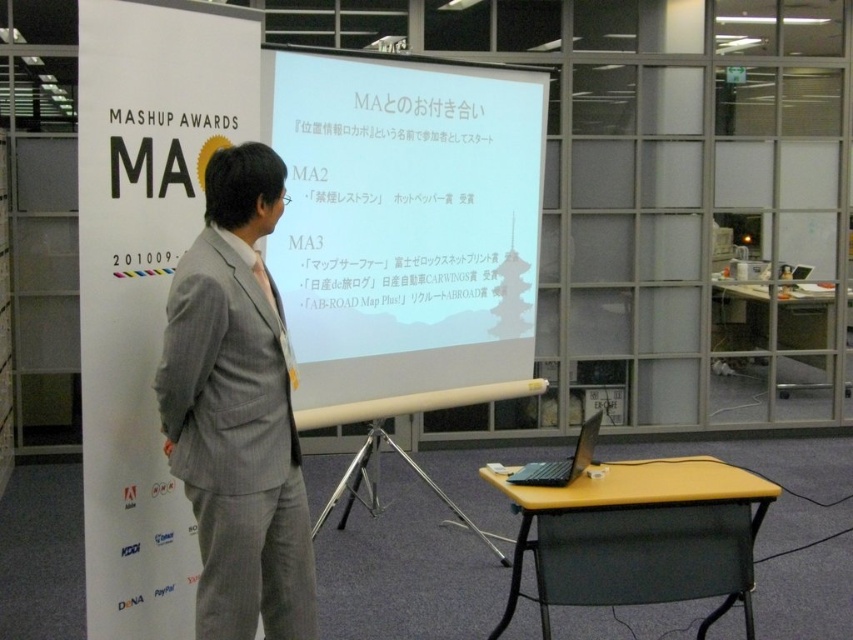
Question: Is white matte projector screen at center smaller than gray textured suit at center?

Choices:
 (A) yes
 (B) no

Answer: (B)

Question: Is white matte projector screen at center positioned before black matte laptop at lower right?

Choices:
 (A) no
 (B) yes

Answer: (A)

Question: Where is white matte projector screen at center located in relation to black matte laptop at lower right in the image?

Choices:
 (A) below
 (B) above

Answer: (B)

Question: Which point is farther to the camera?

Choices:
 (A) white matte projector screen at center
 (B) black matte laptop at lower right

Answer: (A)

Question: Which object is positioned closest to the gray textured suit at center?

Choices:
 (A) black matte laptop at lower right
 (B) white matte projector screen at center

Answer: (A)

Question: Estimate the real-world distances between objects in this image. Which object is closer to the black matte laptop at lower right?

Choices:
 (A) gray textured suit at center
 (B) white matte projector screen at center

Answer: (A)